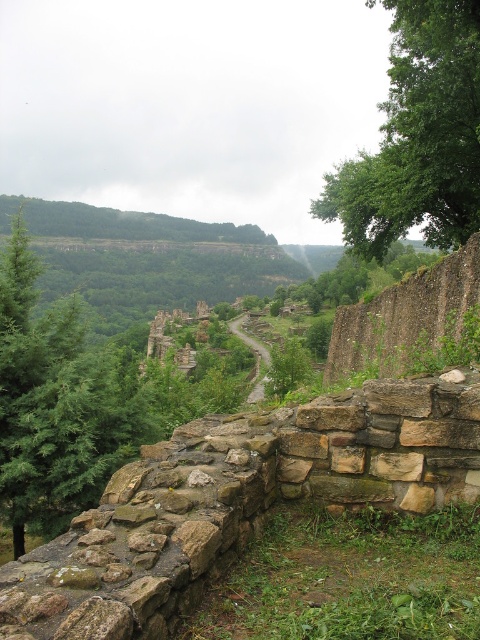
You are standing at the edge of the stone wall and want to walk towards the green leafy tree at upper right. Which direction should you turn to face the brown stone path at center before proceeding?

You should turn to your left to face the brown stone path at center, as the green leafy tree at upper right is located to the right of the brown stone path at center.